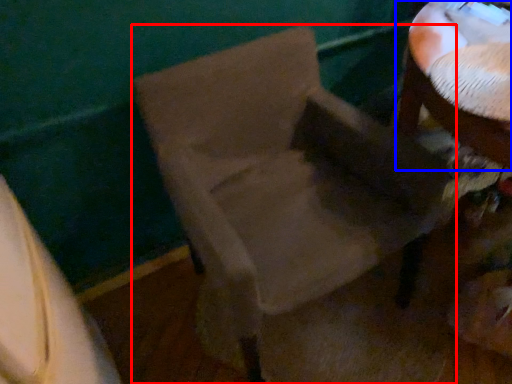
Question: Which object appears farthest to the camera in this image, chair (highlighted by a red box) or table (highlighted by a blue box)?

Choices:
 (A) chair
 (B) table

Answer: (B)